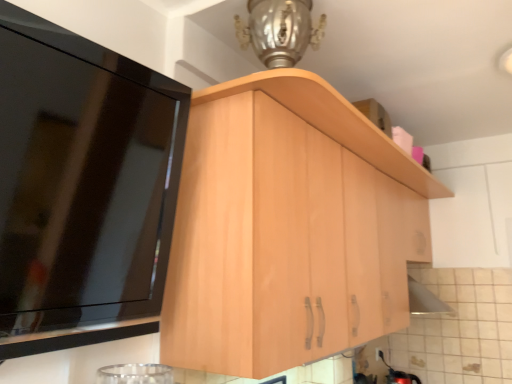
Question: Looking at their shapes, would you say light wood cabinet at center, the second cabinetry in the left-to-right sequence, is wider or thinner than light wood cabinet at upper left, positioned as the first cabinetry in front-to-back order?

Choices:
 (A) wide
 (B) thin

Answer: (A)

Question: From a real-world perspective, is light wood cabinet at center, acting as the first cabinetry starting from the right, above or below light wood cabinet at upper left, which is counted as the first cabinetry, starting from the left?

Choices:
 (A) below
 (B) above

Answer: (A)

Question: From the image's perspective, relative to light wood cabinet at upper left, positioned as the first cabinetry in front-to-back order, is light wood cabinet at center, which is the 2th cabinetry in front-to-back order, above or below?

Choices:
 (A) below
 (B) above

Answer: (A)

Question: Is light wood cabinet at upper left, positioned as the first cabinetry in front-to-back order, inside the boundaries of light wood cabinet at center, the 1th cabinetry viewed from the back, or outside?

Choices:
 (A) outside
 (B) inside

Answer: (A)

Question: Is light wood cabinet at upper left, which is the second cabinetry from right to left, to the left or to the right of light wood cabinet at center, the 1th cabinetry viewed from the back, in the image?

Choices:
 (A) left
 (B) right

Answer: (A)

Question: From a real-world perspective, is light wood cabinet at upper left, which is counted as the first cabinetry, starting from the left, positioned above or below light wood cabinet at center, the second cabinetry in the left-to-right sequence?

Choices:
 (A) below
 (B) above

Answer: (B)

Question: Considering the positions of light wood cabinet at upper left, which is counted as the first cabinetry, starting from the left, and light wood cabinet at center, the second cabinetry in the left-to-right sequence, in the image, is light wood cabinet at upper left, which is counted as the first cabinetry, starting from the left, wider or thinner than light wood cabinet at center, the second cabinetry in the left-to-right sequence,?

Choices:
 (A) thin
 (B) wide

Answer: (A)